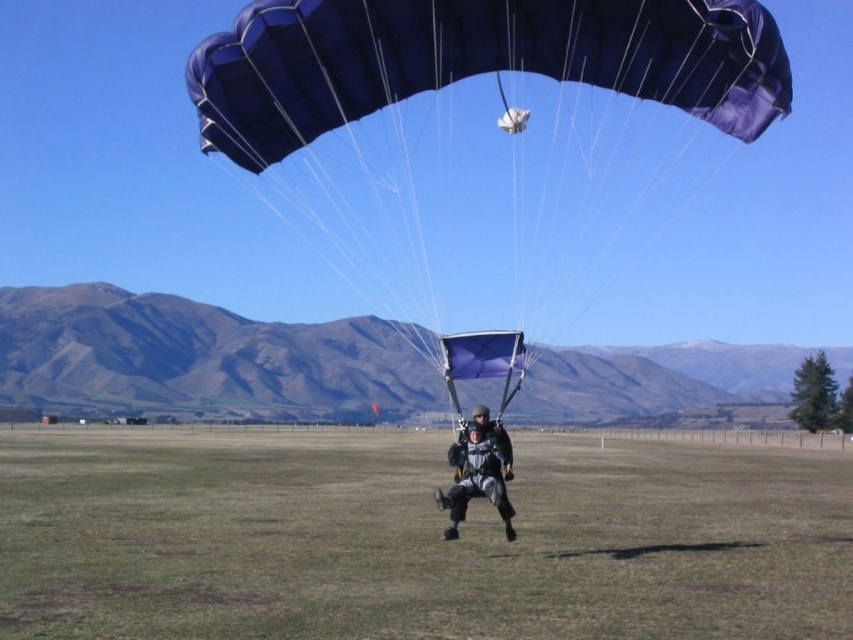
You are a photographer standing on the edge of the green grass at center. You want to take a photo of the blue fabric parachute at center. Which direction should you move to get the best shot?

The green grass at center is positioned on the left side of the blue fabric parachute at center. To get the best shot, you should move to the right side of the blue fabric parachute at center.

You are a skydiving instructor preparing to land. You notice two parachutes in the sky ahead of you. Based on the scene, which of the two parachutes, the blue fabric parachute at center or the black fabric parachute at center, is positioned higher in the sky?

The blue fabric parachute at center is positioned higher in the sky because it is described as much taller than the black fabric parachute at center.